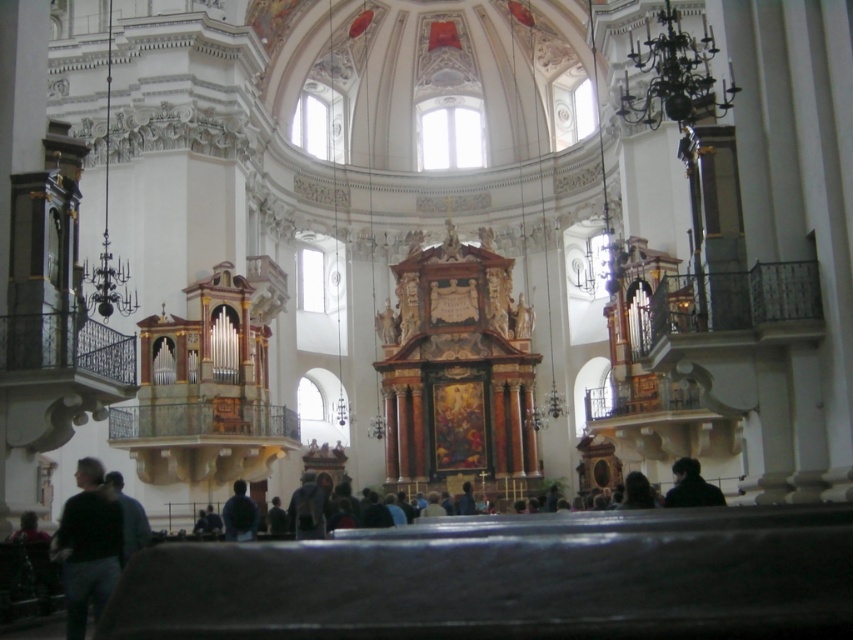
Question: From the image, what is the correct spatial relationship of dark fabric jacket at lower right in relation to dark matte clothing at lower center?

Choices:
 (A) left
 (B) right

Answer: (B)

Question: Observing the image, what is the correct spatial positioning of dark blue shirt at lower center in reference to dark matte clothing at lower center?

Choices:
 (A) left
 (B) right

Answer: (A)

Question: Can you confirm if dark gray sweater at lower left is positioned to the right of dark fabric jacket at lower right?

Choices:
 (A) no
 (B) yes

Answer: (A)

Question: Which object is closer to the camera taking this photo?

Choices:
 (A) dark blue shirt at lower center
 (B) dark gray sweater at lower left
 (C) dark matte clothing at lower center

Answer: (B)

Question: Which of these objects is positioned farthest from the dark matte clothing at lower center?

Choices:
 (A) dark blue shirt at lower center
 (B) dark gray sweater at lower left
 (C) dark fabric jacket at lower right

Answer: (C)

Question: Which point is closer to the camera?

Choices:
 (A) (138, 522)
 (B) (257, 518)

Answer: (A)